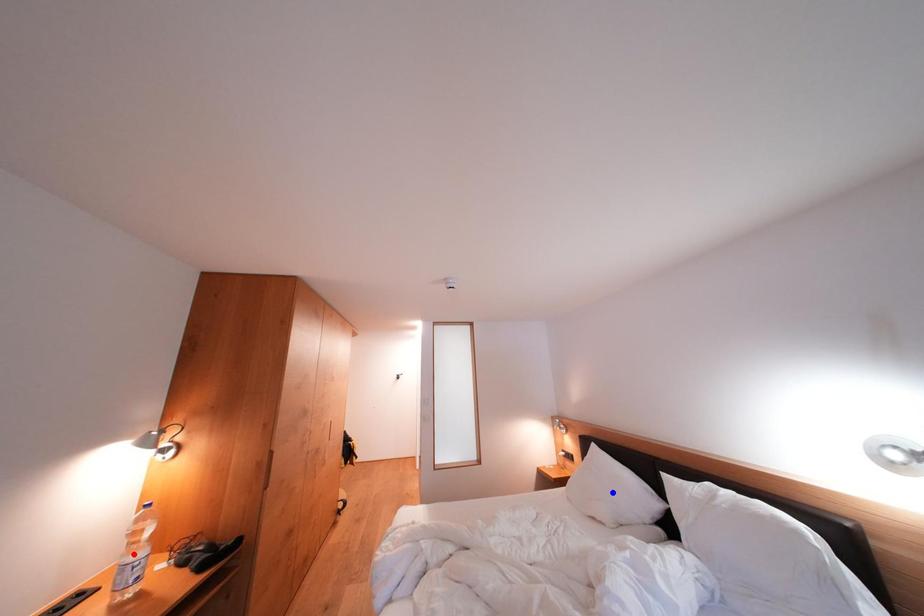
Question: Two points are marked on the image. Which point is closer to the camera?

Choices:
 (A) Blue point is closer.
 (B) Red point is closer.

Answer: (B)